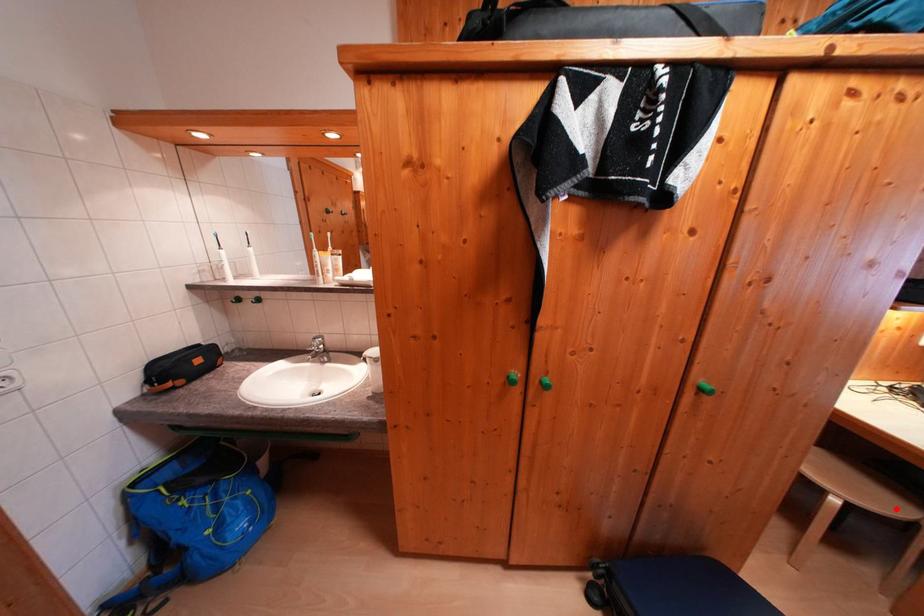
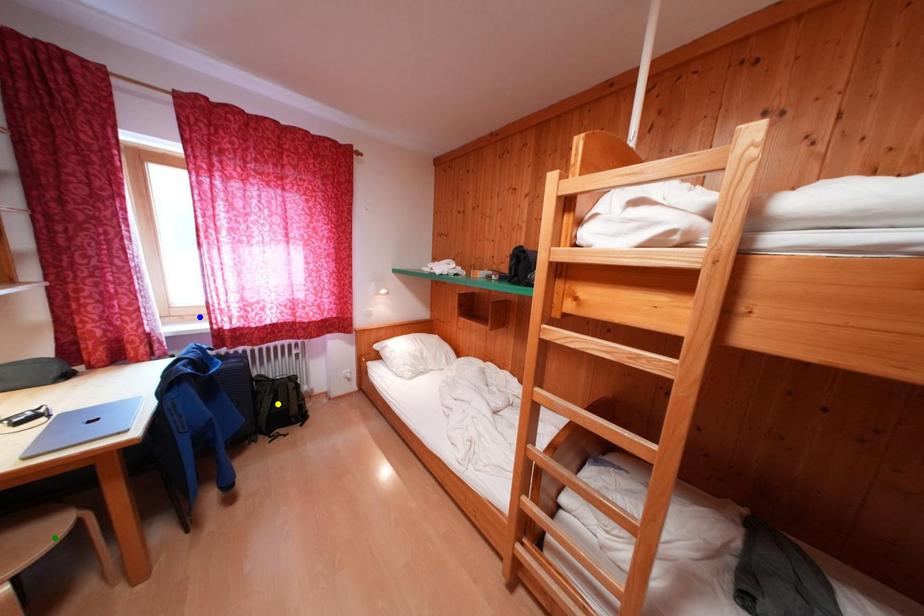
Question: I am providing you with two images of the same scene from different viewpoints. A red point is marked on the first image. You are given multiple points on the second image. Which mark in image 2 goes with the point in image 1?

Choices:
 (A) blue point
 (B) yellow point
 (C) green point

Answer: (C)